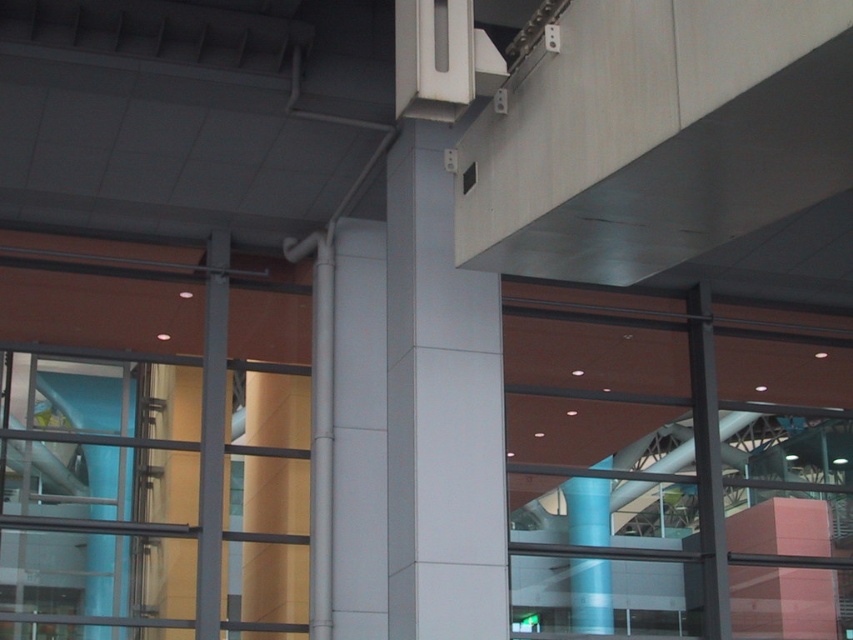
Question: Can you confirm if white glossy pillar at center is smaller than blue glossy column at center?

Choices:
 (A) yes
 (B) no

Answer: (A)

Question: Among these points, which one is nearest to the camera?

Choices:
 (A) (491, 404)
 (B) (573, 604)

Answer: (A)

Question: Which of the following is the farthest from the observer?

Choices:
 (A) white glossy pillar at center
 (B) blue glossy column at center

Answer: (B)

Question: Is white glossy pillar at center positioned behind blue glossy column at center?

Choices:
 (A) no
 (B) yes

Answer: (A)

Question: From the image, what is the correct spatial relationship of white glossy pillar at center in relation to blue glossy column at center?

Choices:
 (A) above
 (B) below

Answer: (A)

Question: Which object is farther from the camera taking this photo?

Choices:
 (A) white glossy pillar at center
 (B) blue glossy column at center

Answer: (B)